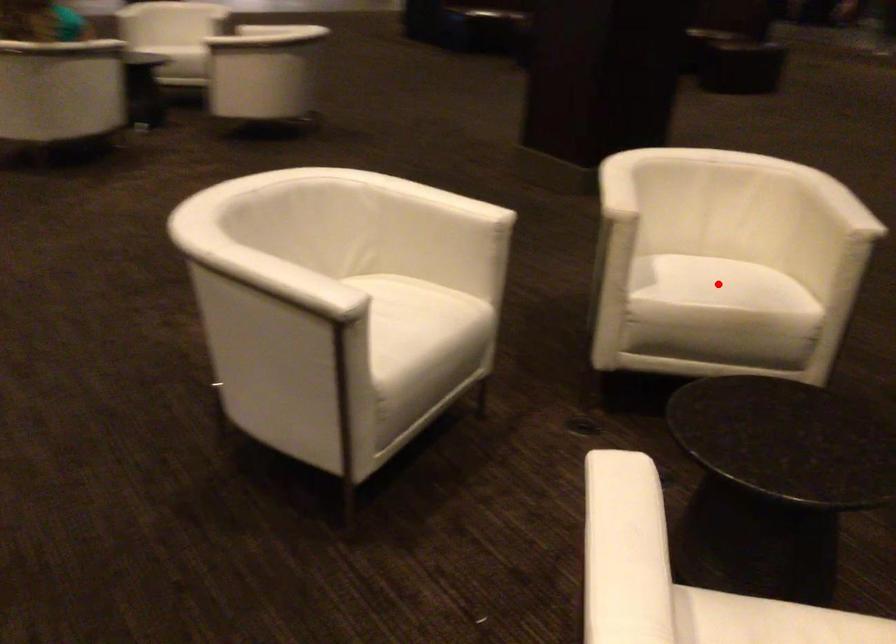
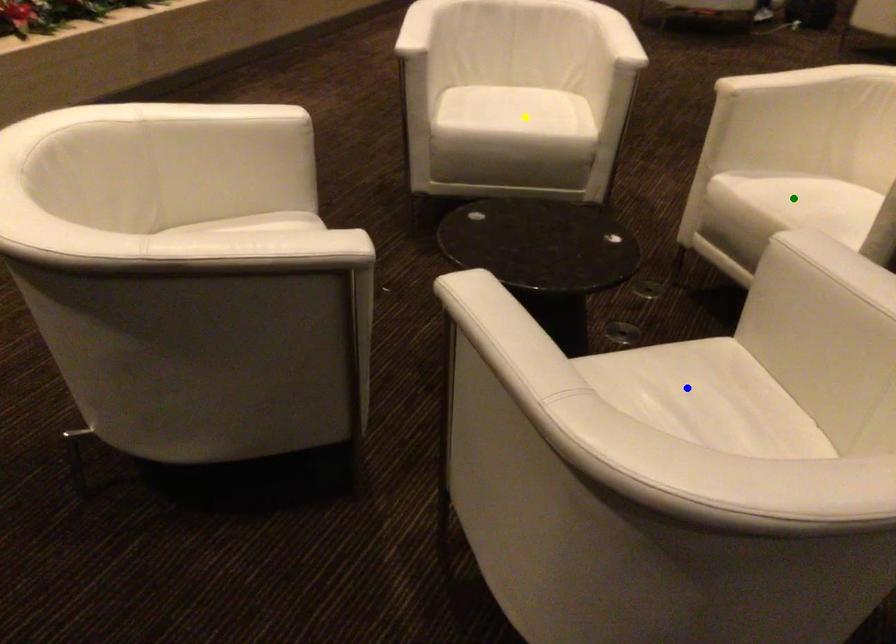
Question: I am providing you with two images of the same scene from different viewpoints. A red point is marked on the first image. You are given multiple points on the second image. Which point in image 2 is actually the same real-world point as the red point in image 1?

Choices:
 (A) blue point
 (B) yellow point
 (C) green point

Answer: (C)